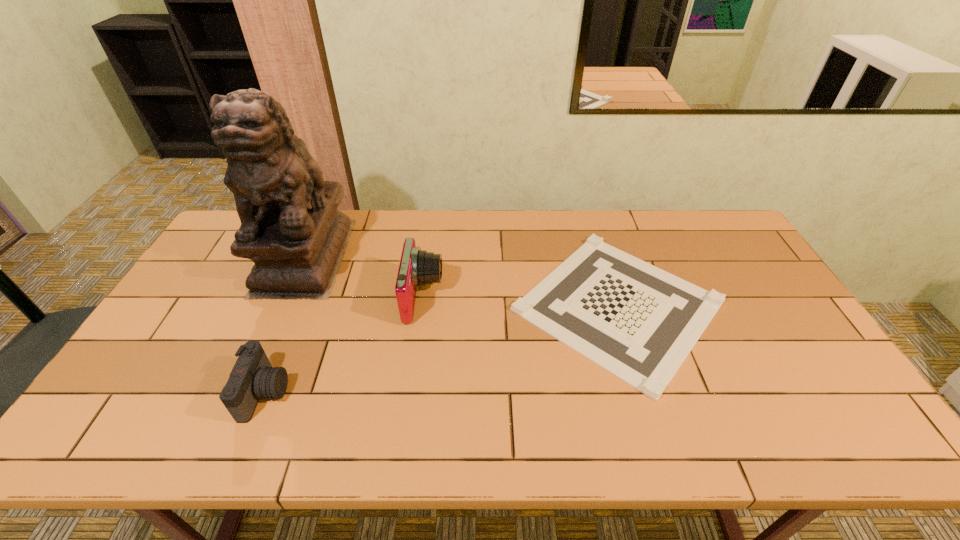
You are a GUI agent. You are given a task and a screenshot of the screen. Output one action in this format:
    pyautogui.click(x=<x>, y=<y>)
    Task: Click on the sculpture
    
    Given the screenshot: What is the action you would take?
    pyautogui.click(x=291, y=229)

Image resolution: width=960 pixels, height=540 pixels. Identify the location of the second tallest object. (417, 267).

Identify the location of the second object from right to left. (417, 267).

Locate an element on the screen. Image resolution: width=960 pixels, height=540 pixels. the shorter camera is located at coordinates (252, 378).

What are the coordinates of `the nearer camera` in the screenshot? It's located at point(252,378).

In order to click on checkerboard in this screenshot , I will do `click(635, 320)`.

At what (x,y) coordinates should I click in order to perform the action: click on the shortest object. Please return your answer as a coordinate pair (x, y). Looking at the image, I should click on (635, 320).

Identify the location of free point located on the front-facing side of the tallest object. (257, 364).

Where is `free region located on the front-facing side of the right camera`? The height and width of the screenshot is (540, 960). free region located on the front-facing side of the right camera is located at coordinates (575, 298).

The height and width of the screenshot is (540, 960). I want to click on free point located 0.160m at the lens of the third tallest object, so click(x=350, y=393).